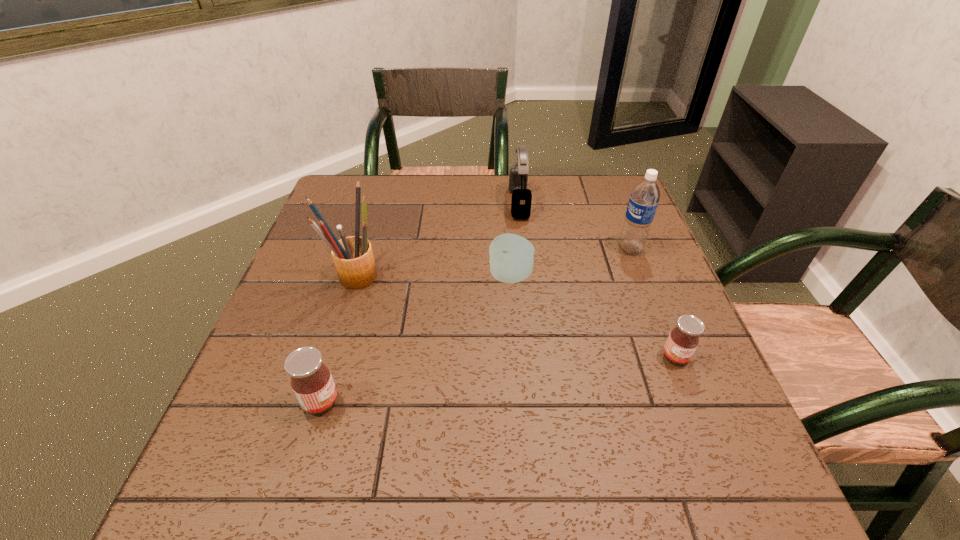
The width and height of the screenshot is (960, 540). I want to click on pencil box at the left edge, so click(353, 257).

At what (x,y) coordinates should I click in order to perform the action: click on jam positioned at the right edge. Please return your answer as a coordinate pair (x, y). Looking at the image, I should click on (683, 340).

The width and height of the screenshot is (960, 540). What are the coordinates of `water bottle located at the right edge` in the screenshot? It's located at (644, 198).

The height and width of the screenshot is (540, 960). What are the coordinates of `object that is at the near left corner` in the screenshot? It's located at (311, 380).

At what (x,y) coordinates should I click in order to perform the action: click on free location at the far edge. Please return your answer as a coordinate pair (x, y). The width and height of the screenshot is (960, 540). Looking at the image, I should click on (407, 195).

What are the coordinates of `vacant space at the near edge of the desktop` in the screenshot? It's located at (472, 424).

Identify the location of blank space at the left edge of the desktop. (283, 387).

In the image, there is a desktop. Identify the location of vacant region at the right edge. Image resolution: width=960 pixels, height=540 pixels. (696, 361).

Where is `free spot at the far left corner of the desktop`? The width and height of the screenshot is (960, 540). free spot at the far left corner of the desktop is located at coordinates (341, 195).

The height and width of the screenshot is (540, 960). In the image, there is a desktop. Identify the location of vacant space at the near left corner. (296, 444).